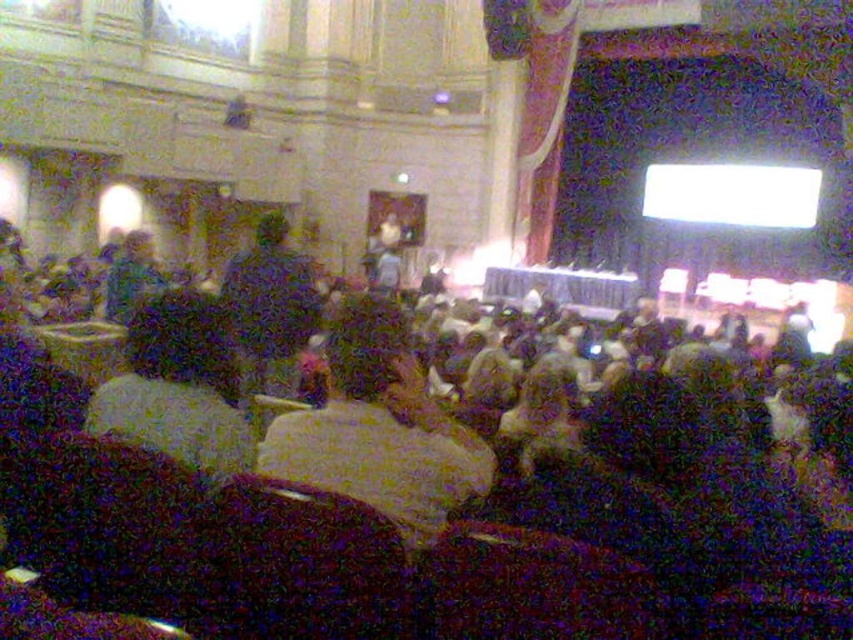
Question: Which object is positioned closest to the fluffy beige sweater at center?

Choices:
 (A) dark blue shirt at center
 (B) dark brown leather jacket at center

Answer: (A)

Question: Can you confirm if dark brown leather jacket at center is positioned above dark blue shirt at center?

Choices:
 (A) no
 (B) yes

Answer: (A)

Question: Which is nearer to the dark brown leather jacket at center?

Choices:
 (A) fluffy beige sweater at center
 (B) dark blue shirt at center

Answer: (B)

Question: Which of the following is the closest to the observer?

Choices:
 (A) (178, 454)
 (B) (125, 262)
 (C) (244, 326)
 (D) (334, 387)

Answer: (A)

Question: Is dark brown leather jacket at center thinner than dark blue shirt at center?

Choices:
 (A) no
 (B) yes

Answer: (A)

Question: Does light brown fabric chair at center appear on the right side of fluffy beige sweater at center?

Choices:
 (A) yes
 (B) no

Answer: (A)